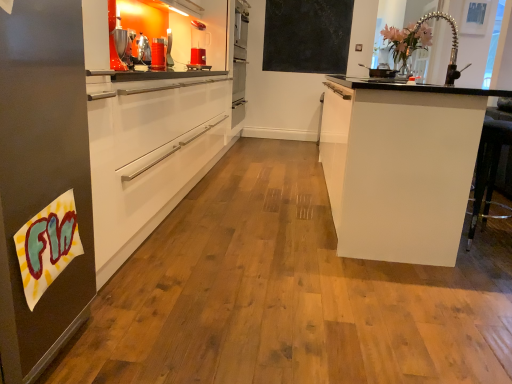
Find the location of a particular element. vacant area that is in front of white glossy cabinet at right is located at coordinates (309, 294).